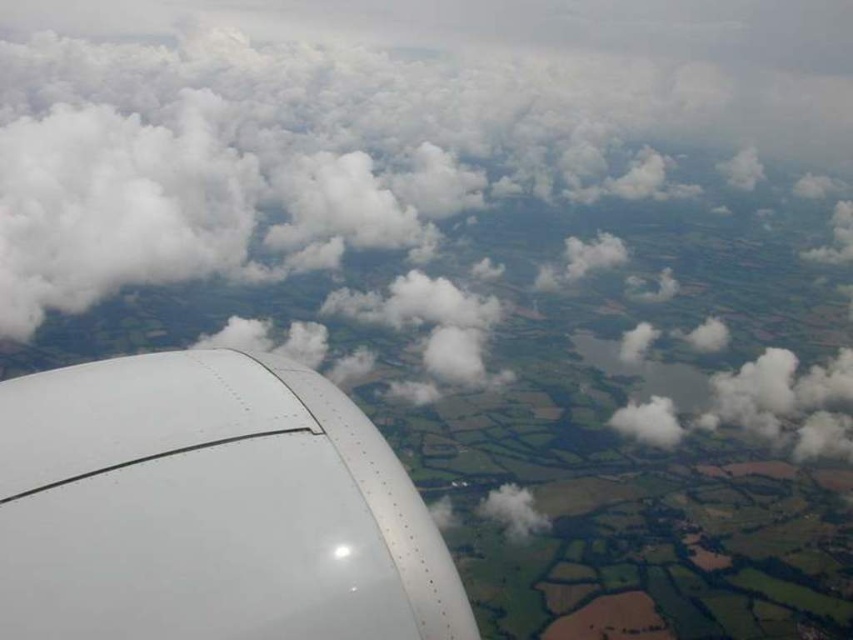
In the scene shown: Does white fluffy cloud at lower left lie behind white matte engine at lower left?

Yes, it is behind white matte engine at lower left.

Between white fluffy cloud at lower left and white matte engine at lower left, which one has more height?

white fluffy cloud at lower left

Where is `white fluffy cloud at lower left`? This screenshot has width=853, height=640. white fluffy cloud at lower left is located at coordinates (448, 204).

Identify the location of white fluffy cloud at lower left. The width and height of the screenshot is (853, 640). (448, 204).